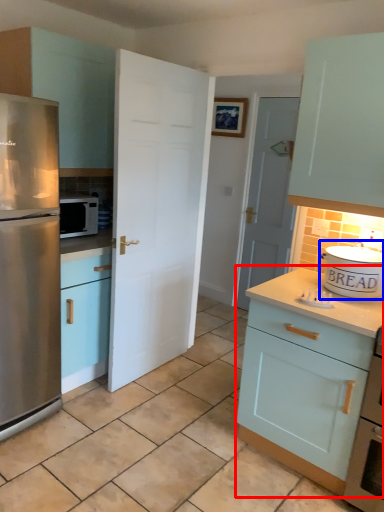
Question: Which point is further to the camera, cabinetry (highlighted by a red box) or appliance (highlighted by a blue box)?

Choices:
 (A) cabinetry
 (B) appliance

Answer: (B)